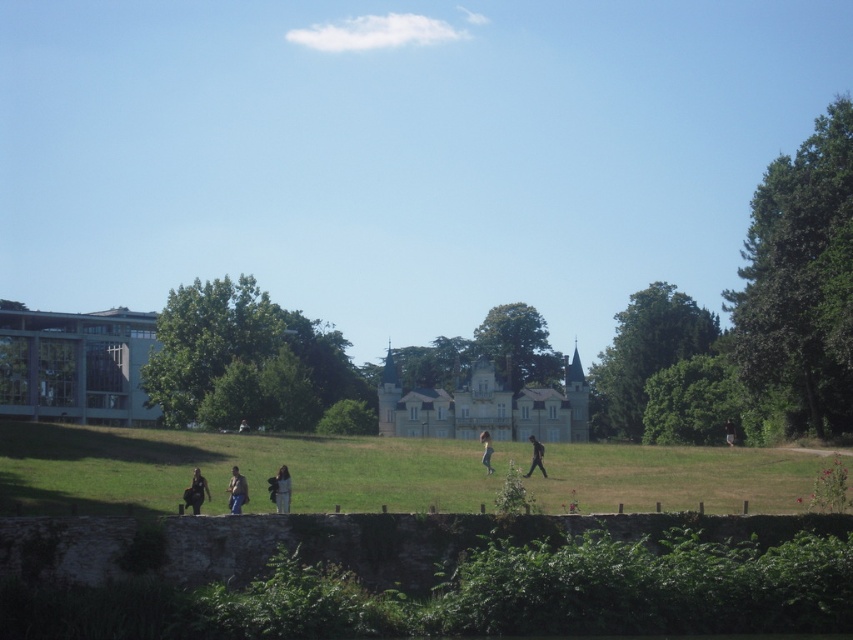
Between green grassy field at lower center and dark brown leather jacket at lower left, which one has more height?

green grassy field at lower center

Does green grassy field at lower center appear over dark brown leather jacket at lower left?

Yes, green grassy field at lower center is above dark brown leather jacket at lower left.

Find the location of a particular element. This screenshot has height=640, width=853. green grassy field at lower center is located at coordinates (241, 468).

Is dark brown leather jacket at lower left below dark brown fabric at lower right?

No.

Between point (194, 468) and point (730, 429), which one is positioned in front?

Positioned in front is point (194, 468).

Who is more distant from viewer, (206, 484) or (727, 424)?

The point (727, 424) is behind.

This screenshot has width=853, height=640. I want to click on dark brown leather jacket at lower left, so click(x=196, y=492).

Based on the photo, which of these two, green grassy field at lower center or light brown leather jacket at lower center, stands shorter?

With less height is light brown leather jacket at lower center.

Can you confirm if green grassy field at lower center is positioned to the left of light brown leather jacket at lower center?

In fact, green grassy field at lower center is to the right of light brown leather jacket at lower center.

Who is more distant from viewer, (474, 480) or (242, 502)?

The point (474, 480) is behind.

At what (x,y) coordinates should I click in order to perform the action: click on green grassy field at lower center. Please return your answer as a coordinate pair (x, y). Looking at the image, I should click on (241, 468).